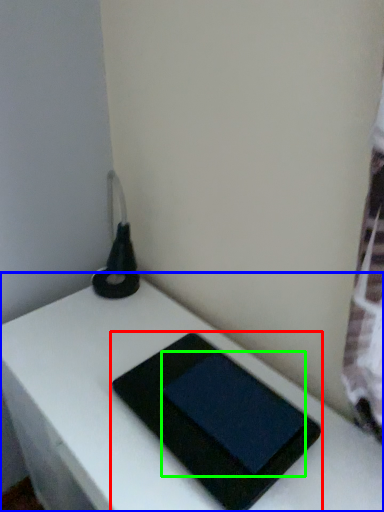
Question: Which object is positioned farthest from tablet computer (highlighted by a red box)? Select from table (highlighted by a blue box) and tablet computer (highlighted by a green box).

Choices:
 (A) table
 (B) tablet computer

Answer: (A)